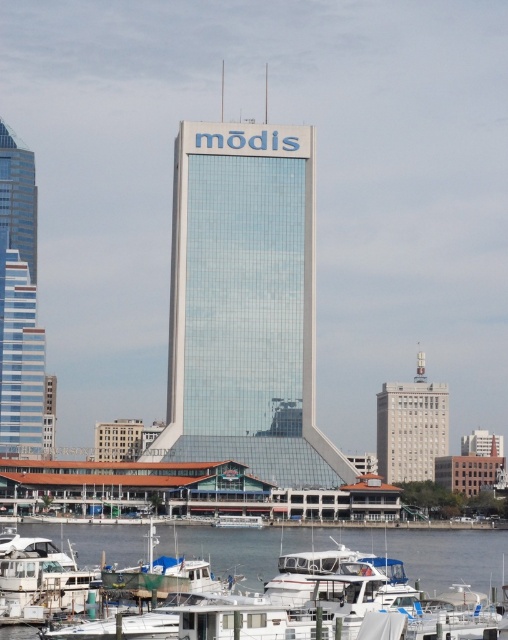
You are standing at the waterfront and see the white glossy boat at lower center and the gray concrete building at center. According to the scene, which object is positioned lower in the image?

The white glossy boat at lower center is positioned lower than the gray concrete building at center in the image.

You are standing at point (244,305) in the image. What object is located exactly at this point?

The transparent glass tower at center is located exactly at point (244,305).

You are a photographer planning to capture a wide shot of the waterfront scene. You want to ensure that both the white glossy boat at lower center and the gray concrete building at center are fully visible in the frame. Given their sizes, which object should you prioritize positioning closer to the camera to maintain their relative sizes in the photograph?

The white glossy boat at lower center is wider than the gray concrete building at center. To maintain their relative sizes in the photograph, you should position the white glossy boat at lower center closer to the camera since wider objects need to be nearer to appear proportionate to smaller ones in the frame.